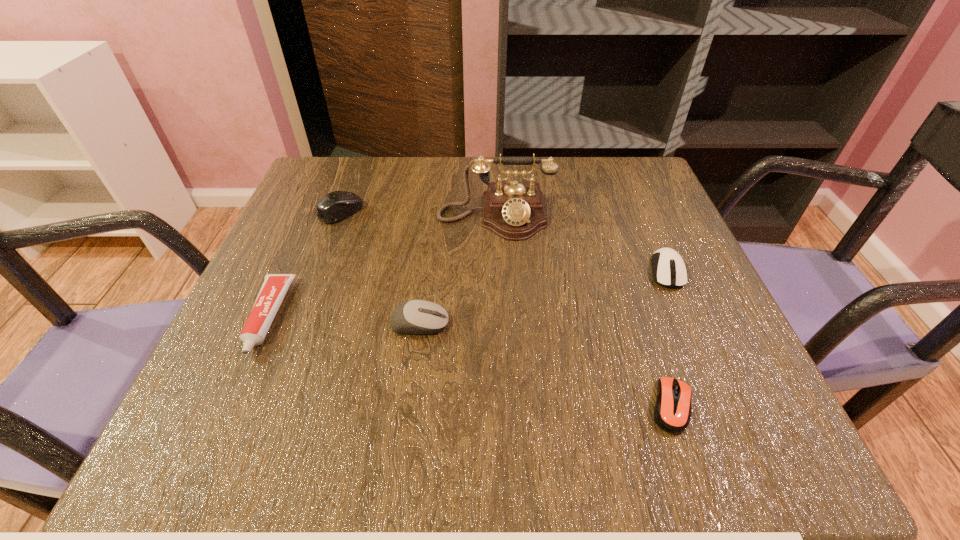
Find the location of a particular element. This screenshot has height=540, width=960. vacant space that's between the toothpaste and the rightmost object is located at coordinates (468, 294).

This screenshot has height=540, width=960. I want to click on free space between the nearest computer mouse and the second nearest computer mouse, so click(x=546, y=365).

This screenshot has height=540, width=960. In order to click on free space that is in between the third farthest computer mouse and the toothpaste in this screenshot , I will do `click(344, 321)`.

Identify the location of empty location between the shortest computer mouse and the rightmost computer mouse. (669, 339).

Find the location of `unoccupied position between the farthest computer mouse and the second computer mouse from left to right`. unoccupied position between the farthest computer mouse and the second computer mouse from left to right is located at coordinates (380, 268).

Where is `vacant area between the nearest object and the toothpaste`? vacant area between the nearest object and the toothpaste is located at coordinates (470, 362).

Point out which object is positioned as the nearest to the nearest computer mouse. Please provide its 2D coordinates. Your answer should be formatted as a tuple, i.e. [(x, y)], where the tuple contains the x and y coordinates of a point satisfying the conditions above.

[(669, 270)]

Select which object is the closest to the leftmost computer mouse. Please provide its 2D coordinates. Your answer should be formatted as a tuple, i.e. [(x, y)], where the tuple contains the x and y coordinates of a point satisfying the conditions above.

[(514, 210)]

Choose which computer mouse is the nearest neighbor to the farthest computer mouse. Please provide its 2D coordinates. Your answer should be formatted as a tuple, i.e. [(x, y)], where the tuple contains the x and y coordinates of a point satisfying the conditions above.

[(417, 316)]

Find the location of a particular element. This screenshot has width=960, height=540. the third closest computer mouse to the second object from right to left is located at coordinates (335, 206).